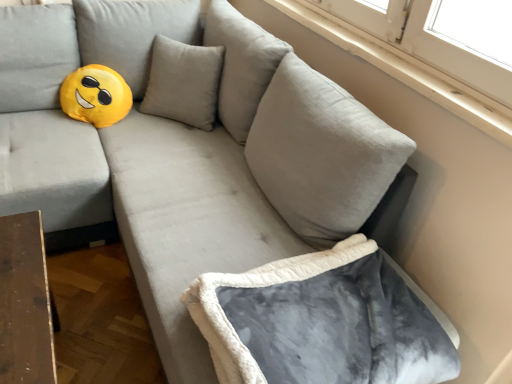
Question: Considering the positions of white smooth window sill at upper right and gray fleece bean bag chair at lower right in the image, is white smooth window sill at upper right bigger or smaller than gray fleece bean bag chair at lower right?

Choices:
 (A) small
 (B) big

Answer: (A)

Question: From a real-world perspective, is white smooth window sill at upper right above or below gray fleece bean bag chair at lower right?

Choices:
 (A) below
 (B) above

Answer: (B)

Question: Do you think white smooth window sill at upper right is within gray fleece bean bag chair at lower right, or outside of it?

Choices:
 (A) outside
 (B) inside

Answer: (A)

Question: Is point (448, 355) closer or farther from the camera than point (474, 124)?

Choices:
 (A) farther
 (B) closer

Answer: (B)

Question: From a real-world perspective, is gray fleece bean bag chair at lower right positioned above or below white smooth window sill at upper right?

Choices:
 (A) below
 (B) above

Answer: (A)

Question: Which is correct: gray fleece bean bag chair at lower right is inside white smooth window sill at upper right, or outside of it?

Choices:
 (A) inside
 (B) outside

Answer: (B)

Question: In the image, is gray fleece bean bag chair at lower right positioned in front of or behind white smooth window sill at upper right?

Choices:
 (A) behind
 (B) front

Answer: (B)